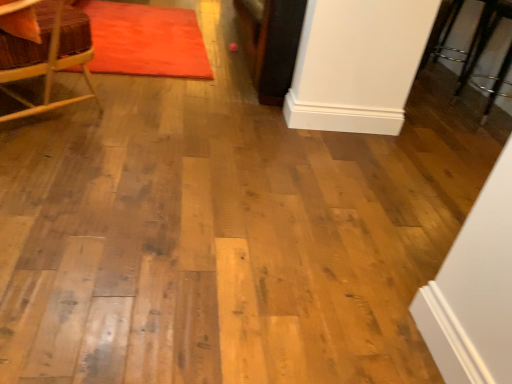
Locate an element on the screen. Image resolution: width=512 pixels, height=384 pixels. vacant area that lies between wooden chair at left and velvet orange mat at upper left is located at coordinates (x=139, y=93).